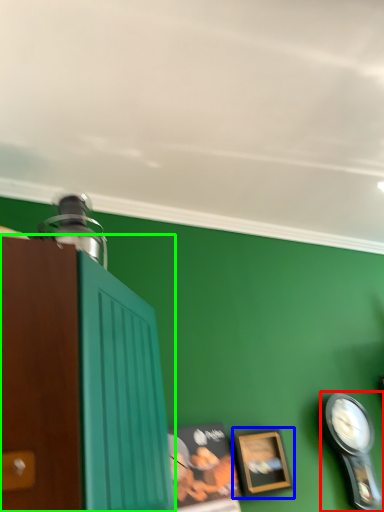
Question: Which is farther away from clock (highlighted by a red box)? picture frame (highlighted by a blue box) or cabinetry (highlighted by a green box)?

Choices:
 (A) picture frame
 (B) cabinetry

Answer: (B)